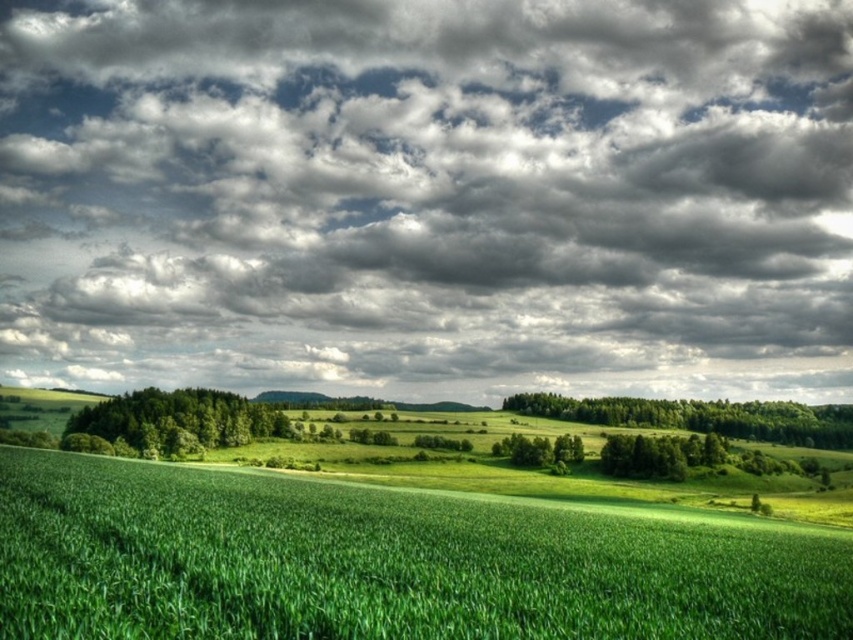
Is green leafy forest at center taller than green leafy tree at center?

Yes, green leafy forest at center is taller than green leafy tree at center.

Is point (231, 429) positioned in front of point (547, 445)?

Yes, point (231, 429) is in front of point (547, 445).

This screenshot has height=640, width=853. Find the location of `green leafy forest at center`. green leafy forest at center is located at coordinates (178, 420).

The height and width of the screenshot is (640, 853). Identify the location of green leafy forest at right. (700, 417).

Can you confirm if cloudy sky at upper center is shorter than green leafy tree at center?

No.

Which is more to the left, cloudy sky at upper center or green leafy tree at center?

cloudy sky at upper center is more to the left.

Is point (746, 384) positioned behind point (511, 435)?

Yes, it is.

You are a GUI agent. You are given a task and a screenshot of the screen. Output one action in this format:
    pyautogui.click(x=<x>, y=<y>)
    Task: Click on the cloudy sky at upper center
    
    Given the screenshot: What is the action you would take?
    pyautogui.click(x=428, y=196)